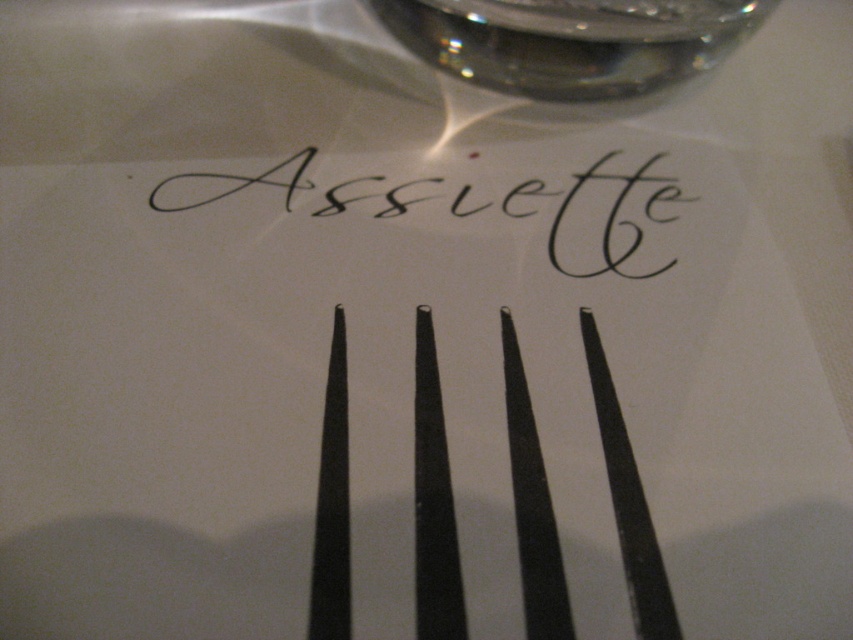
Who is more forward, [451,572] or [688,156]?

Point [451,572]

Locate an element on the screen. black metal fork at center is located at coordinates (433, 502).